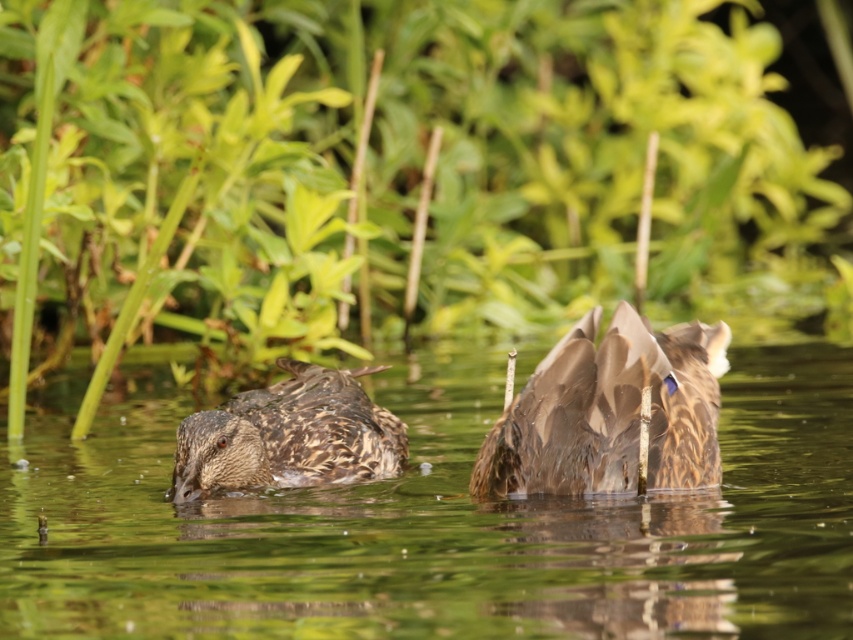
Can you confirm if brown feathered duck at center is positioned to the right of brown speckled feathers at center?

Incorrect, brown feathered duck at center is not on the right side of brown speckled feathers at center.

Does brown feathered duck at center appear over brown speckled feathers at center?

Actually, brown feathered duck at center is below brown speckled feathers at center.

Who is more distant from viewer, (288, 520) or (711, 404)?

The point (288, 520) is more distant.

Find the location of `brown feathered duck at center`. brown feathered duck at center is located at coordinates (438, 525).

Between green leafy plant at center and brown feathered duck at left, which one appears on the left side from the viewer's perspective?

From the viewer's perspective, brown feathered duck at left appears more on the left side.

Which is above, green leafy plant at center or brown feathered duck at left?

green leafy plant at center is above.

Which is in front, point (729, 68) or point (305, 378)?

Point (305, 378)

Where is `green leafy plant at center`? Image resolution: width=853 pixels, height=640 pixels. green leafy plant at center is located at coordinates (392, 179).

Can you confirm if green leafy plant at center is bigger than brown speckled feathers at center?

Yes, green leafy plant at center is bigger than brown speckled feathers at center.

Who is shorter, green leafy plant at center or brown speckled feathers at center?

brown speckled feathers at center is shorter.

Who is more forward, (520,225) or (645,384)?

Point (645,384) is more forward.

Where is `green leafy plant at center`? The width and height of the screenshot is (853, 640). green leafy plant at center is located at coordinates (392, 179).